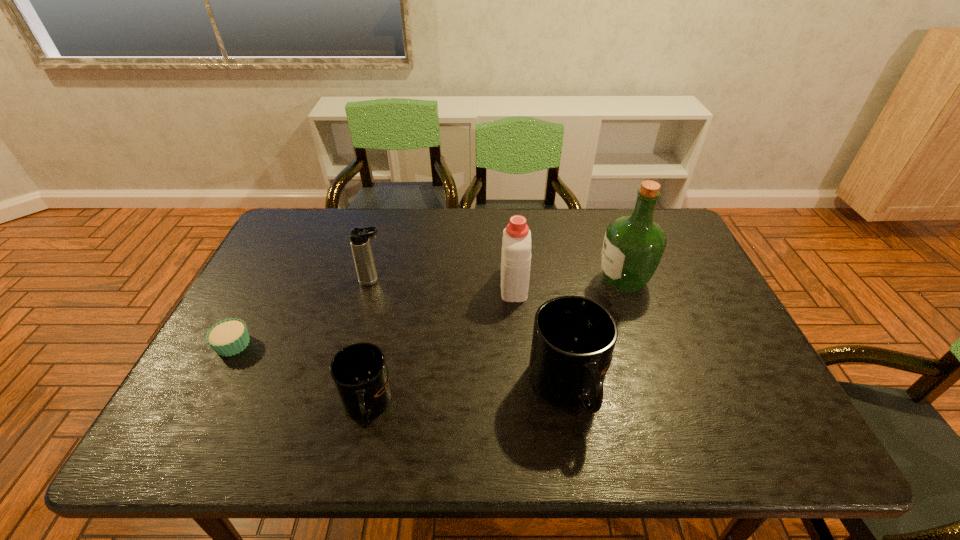
Image resolution: width=960 pixels, height=540 pixels. I want to click on the shorter mug, so click(x=359, y=372).

Locate an element on the screen. The height and width of the screenshot is (540, 960). the left mug is located at coordinates (359, 372).

Where is `the right mug`? The image size is (960, 540). the right mug is located at coordinates (574, 337).

Where is `thermos bottle`? This screenshot has height=540, width=960. thermos bottle is located at coordinates (359, 237).

Where is `liquor`? liquor is located at coordinates (633, 246).

Locate an element on the screen. This screenshot has height=540, width=960. the rightmost object is located at coordinates (633, 246).

At what (x,y) coordinates should I click in order to perform the action: click on the second tallest object. Please return your answer as a coordinate pair (x, y). Looking at the image, I should click on (516, 243).

Locate an element on the screen. The image size is (960, 540). the shortest object is located at coordinates (228, 337).

I want to click on cupcake, so click(x=228, y=337).

In order to click on vacant region located 0.400m on the handle side of the thermos bottle in this screenshot , I will do `click(524, 281)`.